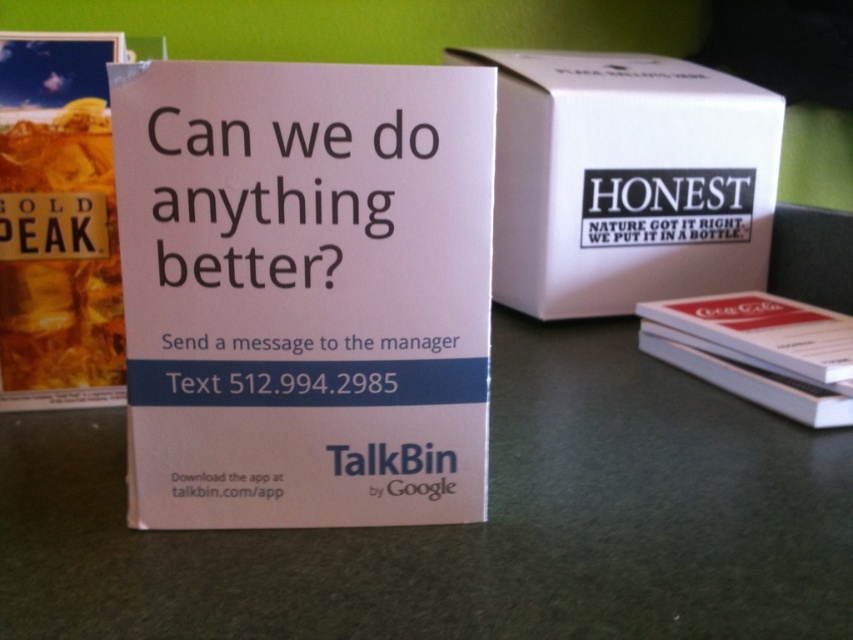
Question: Among these points, which one is farthest from the camera?

Choices:
 (A) (605, 241)
 (B) (22, 193)

Answer: (A)

Question: Does white paperboard at center have a smaller size compared to white paper book at right?

Choices:
 (A) yes
 (B) no

Answer: (A)

Question: Can you confirm if white paperboard at center is positioned to the right of white matte cardboard box at center?

Choices:
 (A) yes
 (B) no

Answer: (B)

Question: Is white paperboard at center below gold peak liquid at left?

Choices:
 (A) yes
 (B) no

Answer: (A)

Question: Which point is farther to the camera?

Choices:
 (A) white paper book at right
 (B) white matte cardboard box at center
 (C) gold peak liquid at left

Answer: (B)

Question: Among these points, which one is farthest from the camera?

Choices:
 (A) (184, 180)
 (B) (657, 317)

Answer: (B)